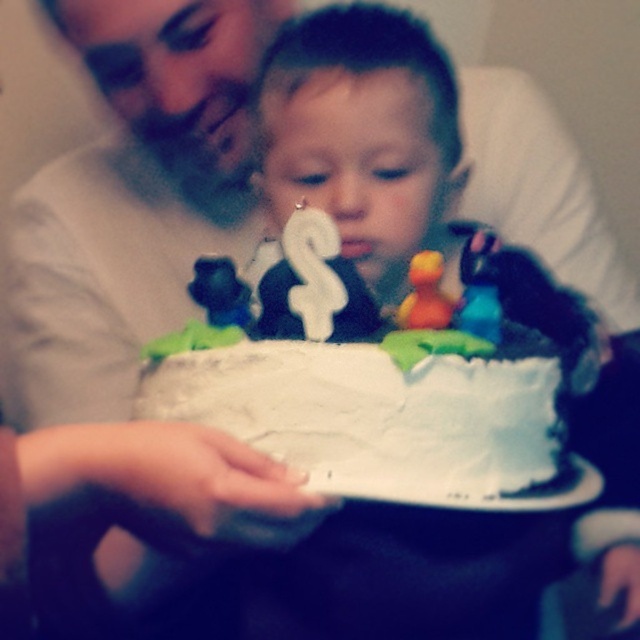
You are a birthday party planner who needs to ensure all decorations are properly arranged. Given the scene, which object is wider between the white matte candle at center and the orange rubber duck at center?

The white matte candle at center is wider than the orange rubber duck at center according to the description.

Looking at this image, you are a photographer standing in front of the white frosted cake at center and the matte white shirt at upper left. Which object is closer to you?

The matte white shirt at upper left is closer to you because it is further to the viewer than the white frosted cake at center.

Based on the photo, you are a photographer standing 1.5 meters away from the birthday cake. You want to take a closeup shot of the white candle shaped like the number 2, which is located at point [116,166]. Can you focus on this candle without moving your camera? Please explain your reasoning.

The distance of point [116,166] from the viewer is 1.02 meters. Since the photographer is standing 1.5 meters away from the cake, the candle is closer than the photographer, so focusing on it without moving the camera may be challenging as it is outside the current focal plane.